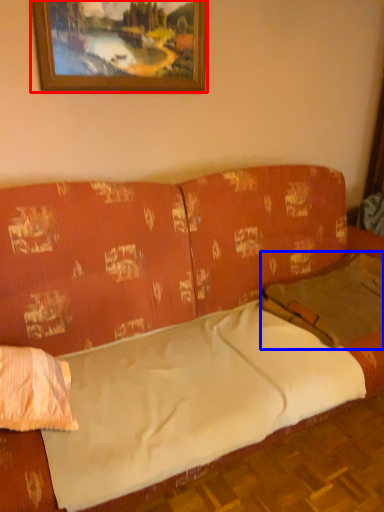
Question: Which point is closer to the camera, picture frame (highlighted by a red box) or pillow (highlighted by a blue box)?

Choices:
 (A) picture frame
 (B) pillow

Answer: (B)